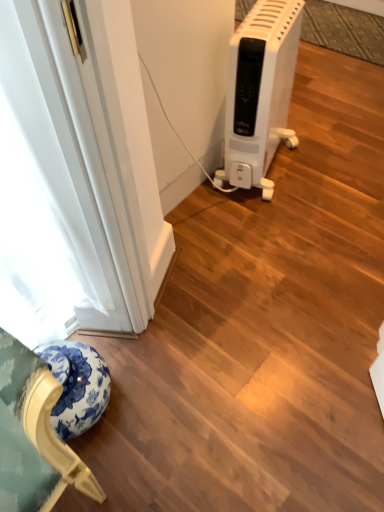
This screenshot has height=512, width=384. Find the location of `free space in front of blue and white ceramic swivel chair at lower left`. free space in front of blue and white ceramic swivel chair at lower left is located at coordinates (107, 446).